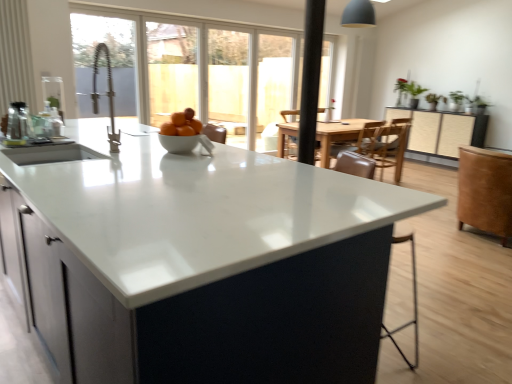
Question: Is white glossy countertop at center not within matte black cabinet at center?

Choices:
 (A) yes
 (B) no

Answer: (A)

Question: Is white glossy countertop at center to the left of matte black cabinet at center from the viewer's perspective?

Choices:
 (A) no
 (B) yes

Answer: (B)

Question: From the image's perspective, is white glossy countertop at center on top of matte black cabinet at center?

Choices:
 (A) no
 (B) yes

Answer: (A)

Question: Considering the relative sizes of white glossy countertop at center and matte black cabinet at center in the image provided, is white glossy countertop at center bigger than matte black cabinet at center?

Choices:
 (A) yes
 (B) no

Answer: (A)

Question: Is white glossy countertop at center taller than matte black cabinet at center?

Choices:
 (A) yes
 (B) no

Answer: (A)

Question: Is matte black cabinet at center inside white glossy countertop at center?

Choices:
 (A) yes
 (B) no

Answer: (B)

Question: Considering the relative positions of black matte pole at center and matte black cabinet at center in the image provided, is black matte pole at center behind matte black cabinet at center?

Choices:
 (A) no
 (B) yes

Answer: (A)

Question: Are black matte pole at center and matte black cabinet at center making contact?

Choices:
 (A) no
 (B) yes

Answer: (A)

Question: Is black matte pole at center not close to matte black cabinet at center?

Choices:
 (A) no
 (B) yes

Answer: (B)

Question: From the image's perspective, does black matte pole at center appear lower than matte black cabinet at center?

Choices:
 (A) yes
 (B) no

Answer: (A)

Question: From a real-world perspective, is black matte pole at center positioned over matte black cabinet at center based on gravity?

Choices:
 (A) yes
 (B) no

Answer: (A)

Question: From a real-world perspective, is black matte pole at center physically below matte black cabinet at center?

Choices:
 (A) no
 (B) yes

Answer: (A)

Question: Does white glossy bowl at center have a greater width compared to white glossy countertop at center?

Choices:
 (A) no
 (B) yes

Answer: (A)